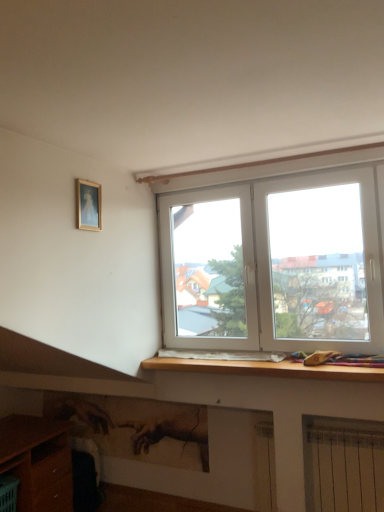
You are a GUI agent. You are given a task and a screenshot of the screen. Output one action in this format:
    pyautogui.click(x=<x>, y=<y>)
    Task: Click on the wooden picture frame at upper left
    The height and width of the screenshot is (512, 384).
    Given the screenshot: What is the action you would take?
    pyautogui.click(x=88, y=205)

What do you see at coordinates (88, 205) in the screenshot? The height and width of the screenshot is (512, 384). I see `wooden picture frame at upper left` at bounding box center [88, 205].

Locate an element on the screen. This screenshot has height=512, width=384. wooden picture frame at upper left is located at coordinates (88, 205).